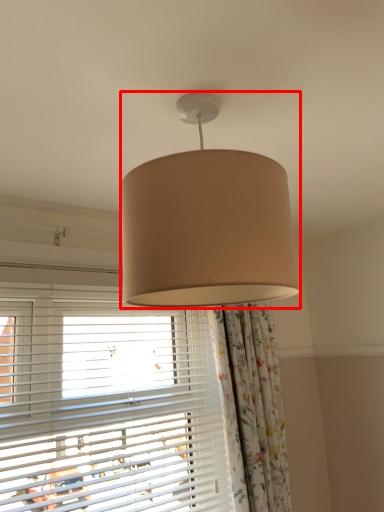
Question: From the image's perspective, where is lamp (annotated by the red box) located relative to window?

Choices:
 (A) above
 (B) below

Answer: (A)